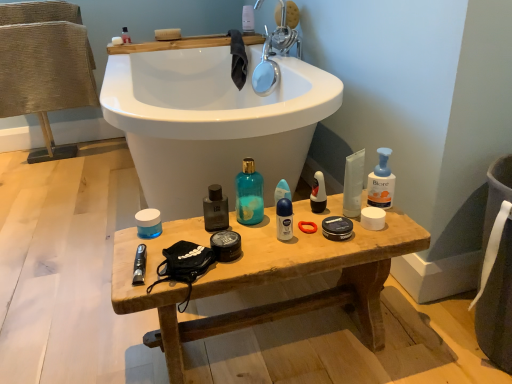
In order to click on vacant position to the left of white matte deodorant at center, marked as the 5th toiletry in a left-to-right arrangement in this screenshot , I will do click(x=238, y=236).